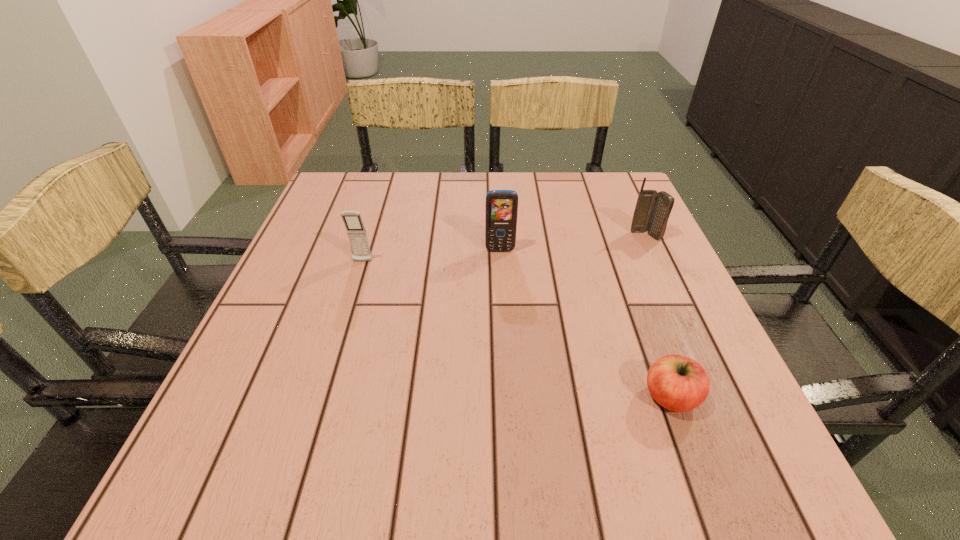
This screenshot has width=960, height=540. Find the location of `free location that satisfies the following two spatial constraints: 1. on the screen of the second object from right to left; 2. on the left side of the third object from right to left`. free location that satisfies the following two spatial constraints: 1. on the screen of the second object from right to left; 2. on the left side of the third object from right to left is located at coordinates (508, 397).